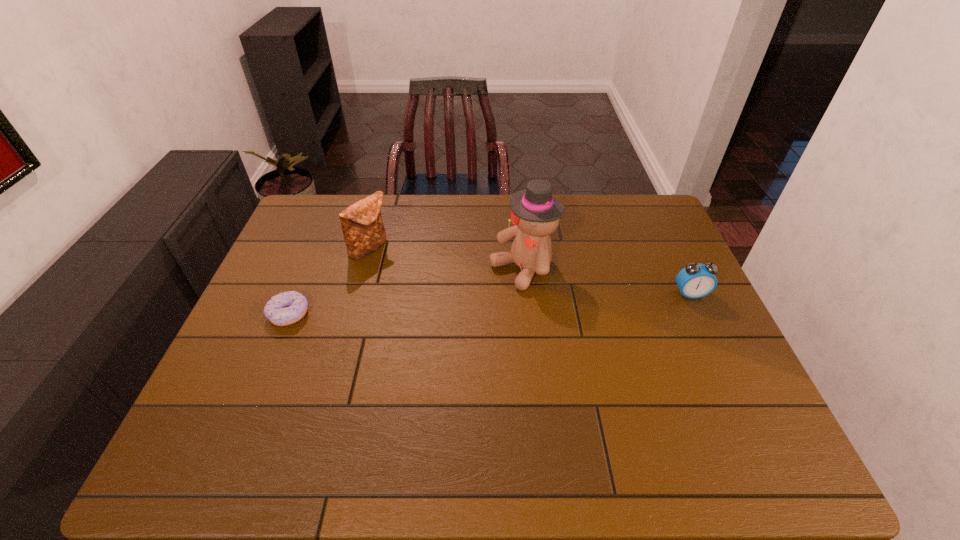
Locate an element on the screen. the leftmost object is located at coordinates (286, 308).

Locate an element on the screen. The width and height of the screenshot is (960, 540). the shortest object is located at coordinates (286, 308).

This screenshot has width=960, height=540. In order to click on the rightmost object in this screenshot , I will do `click(694, 281)`.

Image resolution: width=960 pixels, height=540 pixels. In order to click on alarm clock in this screenshot , I will do `click(694, 281)`.

Where is `the third shortest object`? This screenshot has width=960, height=540. the third shortest object is located at coordinates (363, 230).

The width and height of the screenshot is (960, 540). Identify the location of clutch bag. (363, 230).

The height and width of the screenshot is (540, 960). Identify the location of rag_doll. (535, 213).

Find the location of a particular element. The width and height of the screenshot is (960, 540). the second object from right to left is located at coordinates (535, 213).

Where is `blank area located on the right of the shortest object`? Image resolution: width=960 pixels, height=540 pixels. blank area located on the right of the shortest object is located at coordinates [x=360, y=314].

The height and width of the screenshot is (540, 960). I want to click on free location located on the face of the rightmost object, so click(726, 368).